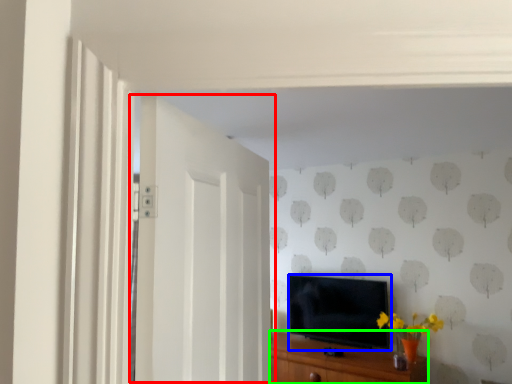
Question: Estimate the real-world distances between objects in this image. Which object is closer to door (highlighted by a red box), television (highlighted by a blue box) or cabinetry (highlighted by a green box)?

Choices:
 (A) television
 (B) cabinetry

Answer: (B)